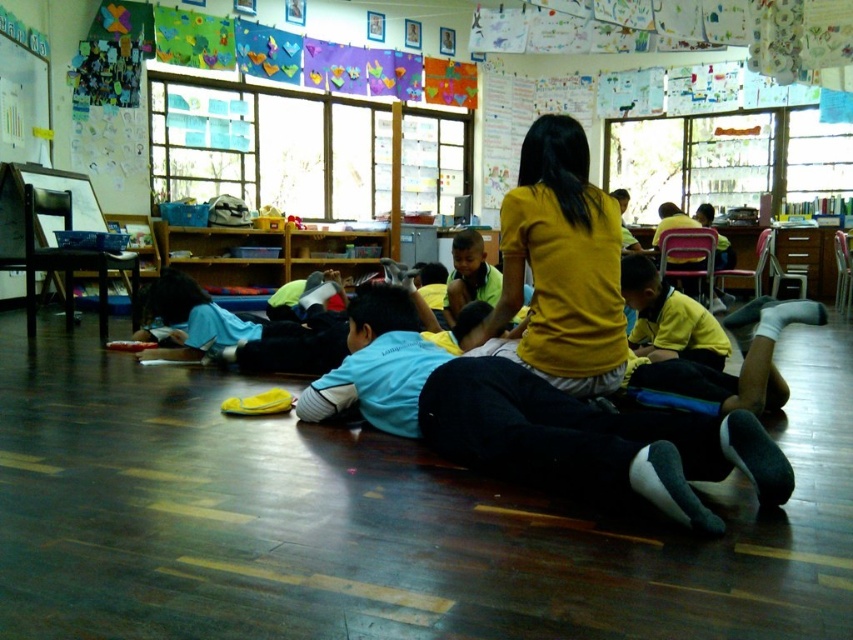
You are a teacher in the classroom and want to hand out a worksheet to both children wearing the blue fabric shirt at center and the yellow matte shirt at center. Since they are lying on the floor, which child should you approach first to ensure you can reach them without stepping over anyone?

You should approach the blue fabric shirt at center first because it is in front of the yellow matte shirt at center, so reaching them would not require stepping over anyone.

You are a teacher in the classroom looking at the children. Which child is shorter between the blue fabric shirt at center and the yellow matte shirt at center?

The blue fabric shirt at center is shorter than the yellow matte shirt at center.